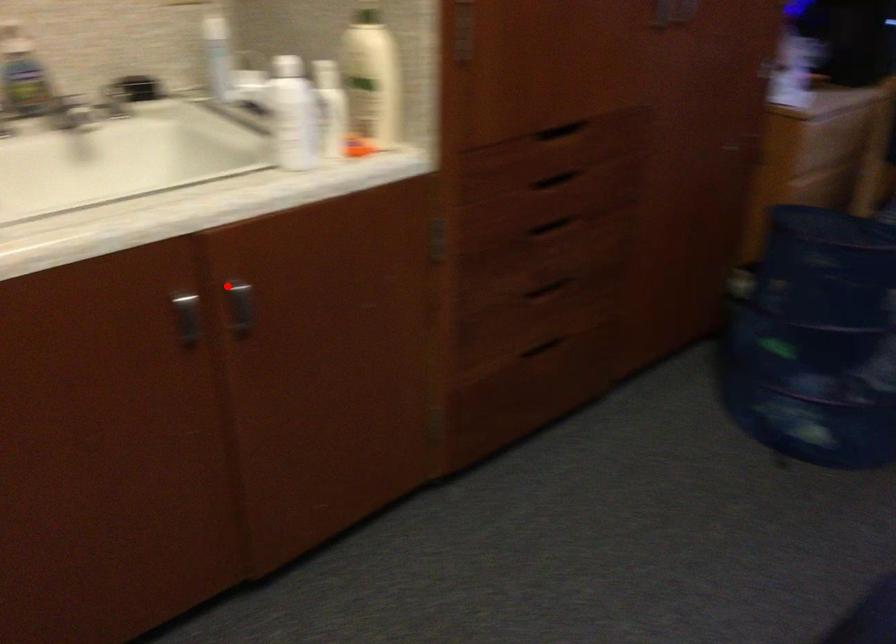
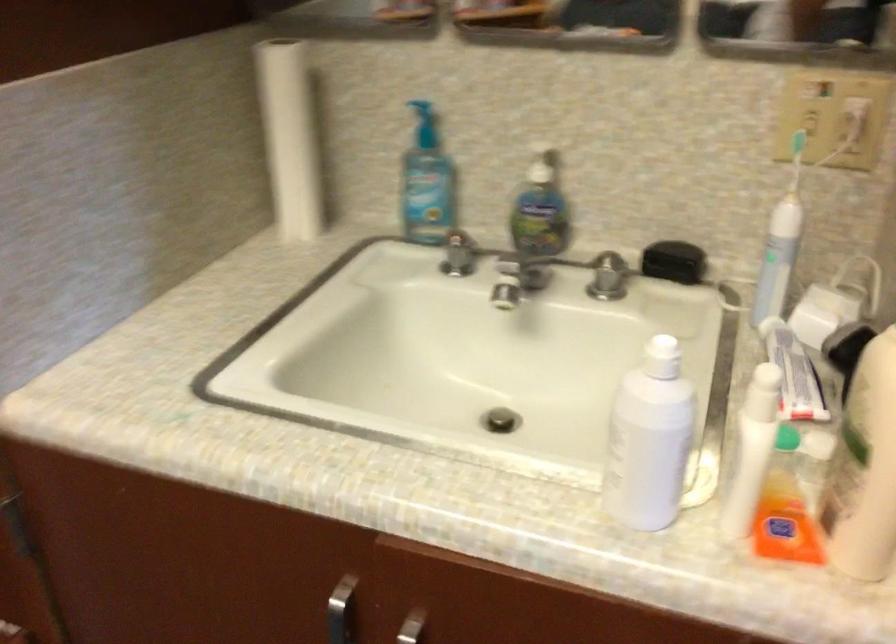
Question: I am providing you with two images of the same scene from different viewpoints. Image1 has a red point marked. In image2, the corresponding 3D location appears at what relative position? Reply with the corresponding letter.

Choices:
 (A) Closer
 (B) Farther

Answer: (A)